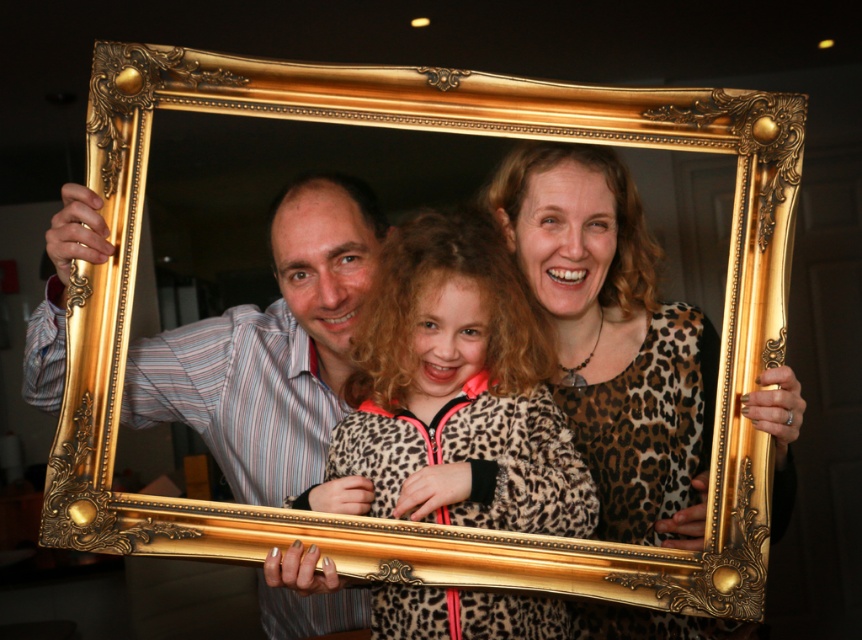
Question: Is leopard print shirt at center positioned in front of striped shirt at left?

Choices:
 (A) yes
 (B) no

Answer: (A)

Question: Based on their relative distances, which object is farther from the leopard print shirt at center?

Choices:
 (A) striped shirt at left
 (B) leopard print coat at center

Answer: (A)

Question: Which of the following is the closest to the observer?

Choices:
 (A) (355, 205)
 (B) (764, 397)

Answer: (B)

Question: Can you confirm if leopard print coat at center is positioned to the right of striped shirt at left?

Choices:
 (A) no
 (B) yes

Answer: (B)

Question: Can you confirm if leopard print coat at center is positioned to the left of striped shirt at left?

Choices:
 (A) yes
 (B) no

Answer: (B)

Question: Considering the real-world distances, which object is farthest from the leopard print coat at center?

Choices:
 (A) striped shirt at left
 (B) leopard print shirt at center

Answer: (A)